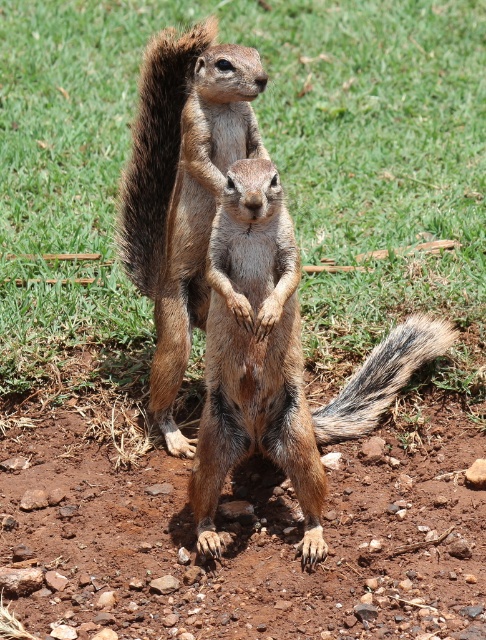
Question: Is green grass at center smaller than brown fur squirrel at center?

Choices:
 (A) yes
 (B) no

Answer: (B)

Question: Among these points, which one is nearest to the camera?

Choices:
 (A) (173, 60)
 (B) (357, 417)
 (C) (423, 272)

Answer: (A)

Question: In this image, where is green grass at center located relative to brown fur squirrel at center?

Choices:
 (A) below
 (B) above

Answer: (B)

Question: Which point is closer to the camera?

Choices:
 (A) (308, 156)
 (B) (189, 134)
 (C) (371, 385)

Answer: (B)

Question: Is brown fur squirrel at center wider than gray-brown fur tail at center?

Choices:
 (A) no
 (B) yes

Answer: (B)

Question: Which object is closer to the camera taking this photo?

Choices:
 (A) gray-brown fur tail at center
 (B) brown fur squirrel at center

Answer: (B)